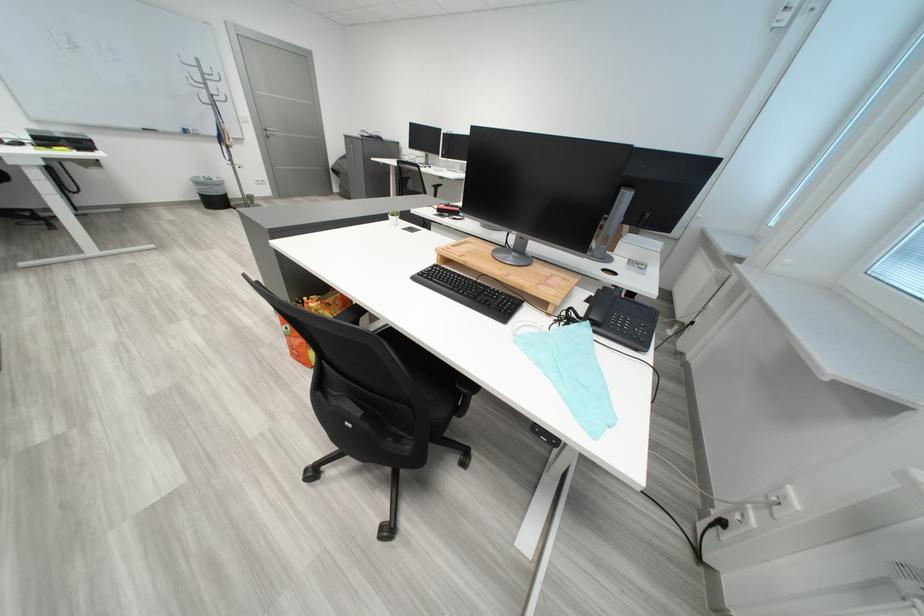
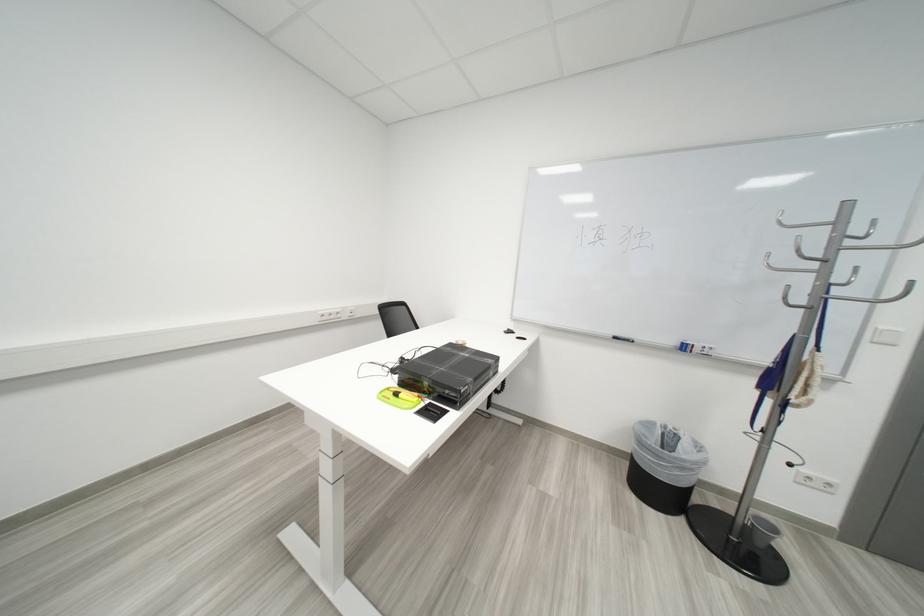
In the second image, find the point that corresponds to pixel 215 75 in the first image.

(853, 238)